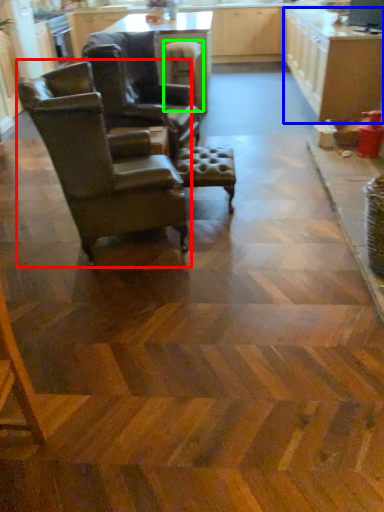
Question: Which object is positioned farthest from chair (highlighted by a red box)? Select from cabinetry (highlighted by a blue box) and bar stool (highlighted by a green box).

Choices:
 (A) cabinetry
 (B) bar stool

Answer: (A)